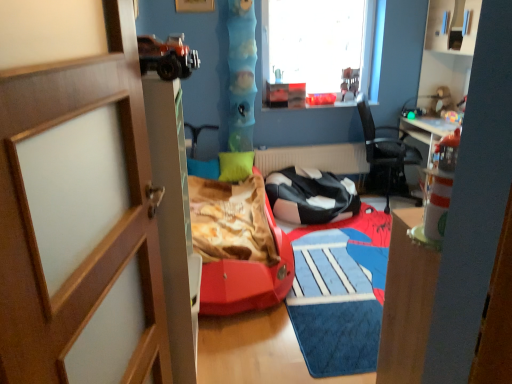
Question: From the image's perspective, is black mesh chair at center, acting as the 2th chair starting from the left, beneath wooden door at left?

Choices:
 (A) yes
 (B) no

Answer: (B)

Question: Can you confirm if black mesh chair at center, acting as the 2th chair starting from the left, is wider than wooden door at left?

Choices:
 (A) yes
 (B) no

Answer: (A)

Question: Does black mesh chair at center, acting as the 2th chair starting from the left, lie behind wooden door at left?

Choices:
 (A) yes
 (B) no

Answer: (A)

Question: Considering the relative sizes of black mesh chair at center, marked as the first chair in a right-to-left arrangement, and wooden door at left in the image provided, is black mesh chair at center, marked as the first chair in a right-to-left arrangement, taller than wooden door at left?

Choices:
 (A) yes
 (B) no

Answer: (B)

Question: Is wooden door at left completely or partially inside black mesh chair at center, acting as the 2th chair starting from the left?

Choices:
 (A) yes
 (B) no

Answer: (B)

Question: Considering the positions of black mesh chair at center, acting as the 2th chair starting from the left, and white matte radiator at center in the image, is black mesh chair at center, acting as the 2th chair starting from the left, wider or thinner than white matte radiator at center?

Choices:
 (A) thin
 (B) wide

Answer: (B)

Question: From the image's perspective, is black mesh chair at center, acting as the 2th chair starting from the left, located above or below white matte radiator at center?

Choices:
 (A) above
 (B) below

Answer: (A)

Question: In the image, is black mesh chair at center, acting as the 2th chair starting from the left, positioned in front of or behind white matte radiator at center?

Choices:
 (A) front
 (B) behind

Answer: (A)

Question: Is black mesh chair at center, marked as the first chair in a right-to-left arrangement, situated inside white matte radiator at center or outside?

Choices:
 (A) outside
 (B) inside

Answer: (A)

Question: Looking at the image, does matte plastic toy at upper right, placed as the first toy when sorted from right to left, seem bigger or smaller compared to white matte radiator at center?

Choices:
 (A) big
 (B) small

Answer: (B)

Question: Considering their positions, is matte plastic toy at upper right, the 2th toy from the left, located in front of or behind white matte radiator at center?

Choices:
 (A) behind
 (B) front

Answer: (B)

Question: Is matte plastic toy at upper right, the 2th toy from the left, taller or shorter than white matte radiator at center?

Choices:
 (A) short
 (B) tall

Answer: (A)

Question: From the image's perspective, is matte plastic toy at upper right, the 2th toy from the left, above or below white matte radiator at center?

Choices:
 (A) above
 (B) below

Answer: (A)

Question: Considering the positions of point (287, 175) and point (297, 3), is point (287, 175) closer or farther from the camera than point (297, 3)?

Choices:
 (A) closer
 (B) farther

Answer: (A)

Question: From the image's perspective, is black leather chair at center, which is the 1th chair in left-to-right order, located above or below transparent glass window at upper center?

Choices:
 (A) below
 (B) above

Answer: (A)